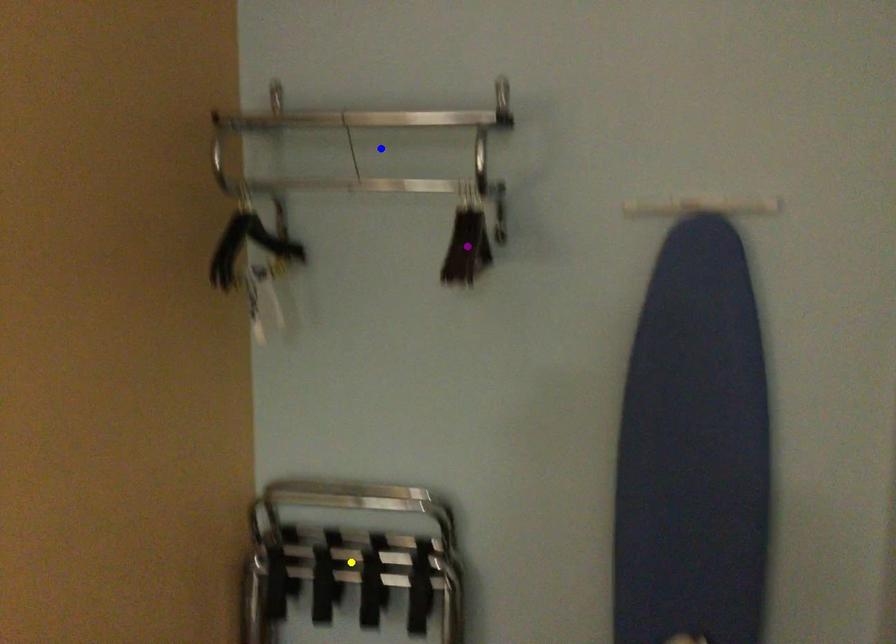
Order these from nearest to farthest:
purple point
yellow point
blue point

yellow point
blue point
purple point